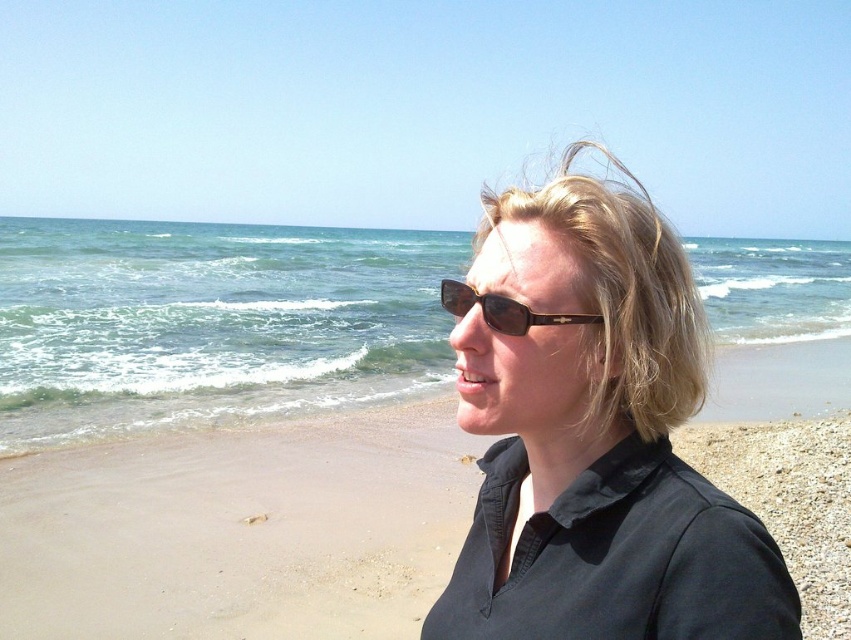
You are a photographer trying to capture the scene. You need to focus on the matte black shirt at center and the sandy beach at lower right. Which object should you adjust your camera focus on first if you want to ensure the closest object is sharp?

The matte black shirt at center is closer to the viewer than the sandy beach at lower right, so you should focus on the matte black shirt at center first to ensure it is sharp.

You are a drone operator trying to locate a specific point on the sandy beach. The coordinates given to you are point (238, 531). Based on the scene, where would this point be located?

Point (238, 531) corresponds to the sandy beach at lower right.

You are a lifeguard standing at the edge of the sandy beach at lower right. You need to quickly reach the person drowning 4 meters away in the ocean. Can you reach them in time if you can run at 5 meters per second?

The sandy beach at lower right and viewer are 4.02 meters apart from each other. Since you can run at 5 meters per second, you can cover 4.02 meters in approximately 0.8 seconds, which is sufficient to reach the drowning person in time.